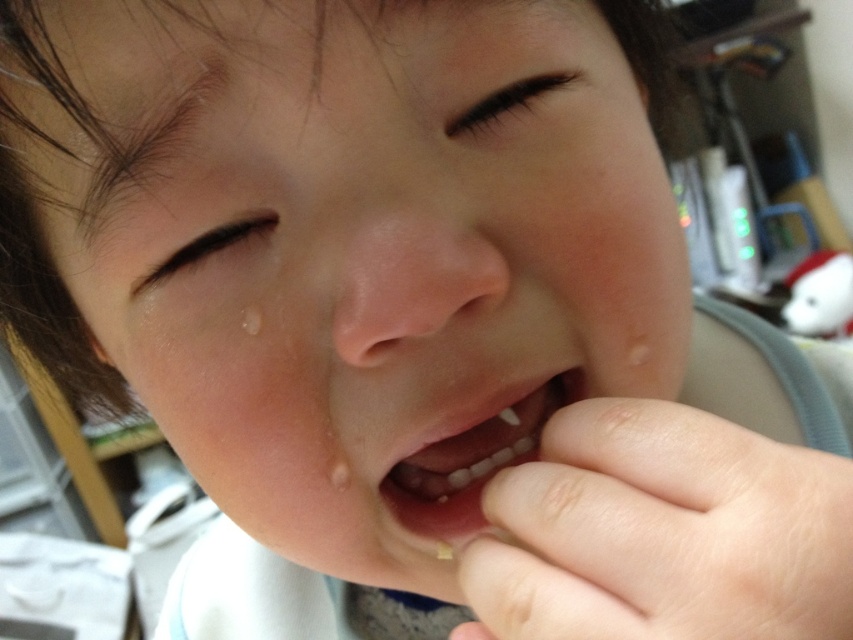
Based on the photo, you are a photographer trying to capture the child in the image. The child has a pale skin hand at mouth. Where should you focus your camera to ensure the hand is in sharp focus?

The pale skin hand at mouth is located at point 0.834 on the x axis and 0.777 on the y axis, so you should focus your camera at those coordinates to ensure the hand is in sharp focus.